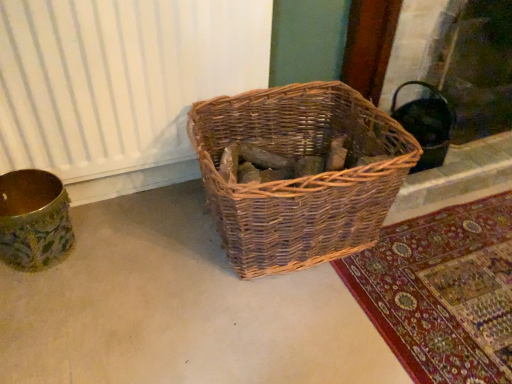
What do you see at coordinates (300, 178) in the screenshot? This screenshot has height=384, width=512. I see `natural woven basket at center` at bounding box center [300, 178].

Locate an element on the screen. gold textured vase at left is located at coordinates (33, 219).

Identify the location of natural woven basket at center. (300, 178).

Is white textured radiator at left spatially inside natural woven basket at center, or outside of it?

white textured radiator at left is not enclosed by natural woven basket at center.

From the image's perspective, who appears lower, white textured radiator at left or natural woven basket at center?

natural woven basket at center.

Who is bigger, white textured radiator at left or natural woven basket at center?

Bigger between the two is natural woven basket at center.

Is point (50, 13) in front of point (289, 114)?

That is True.

Does point (34, 204) lie behind point (493, 100)?

No, (34, 204) is closer to viewer.

Considering the relative sizes of gold textured vase at left and black matte fireplace at upper right in the image provided, is gold textured vase at left wider than black matte fireplace at upper right?

No.

Is gold textured vase at left facing towards black matte fireplace at upper right?

No.

From the image's perspective, is gold textured vase at left under white textured radiator at left?

Indeed, from the image's perspective, gold textured vase at left is shown beneath white textured radiator at left.

Which is behind, gold textured vase at left or white textured radiator at left?

gold textured vase at left is more distant.

Identify the location of radiator in front of the gold textured vase at left. The width and height of the screenshot is (512, 384). (119, 78).

Is gold textured vase at left oriented towards white textured radiator at left?

No, gold textured vase at left does not turn towards white textured radiator at left.

Can we say natural woven basket at center lies outside black matte fireplace at upper right?

Yes.

Consider the image. Who is smaller, natural woven basket at center or black matte fireplace at upper right?

natural woven basket at center is smaller.

Where is `fireplace on the right side of natural woven basket at center`? Image resolution: width=512 pixels, height=384 pixels. fireplace on the right side of natural woven basket at center is located at coordinates coord(464,64).

How many degrees apart are the facing directions of natural woven basket at center and black matte fireplace at upper right?

There is a 3.67-degree angle between the facing directions of natural woven basket at center and black matte fireplace at upper right.

From a real-world perspective, is white textured radiator at left positioned over black matte fireplace at upper right based on gravity?

Yes, from a real-world perspective, white textured radiator at left is over black matte fireplace at upper right

Who is bigger, white textured radiator at left or black matte fireplace at upper right?

Bigger between the two is black matte fireplace at upper right.

Is white textured radiator at left wider or thinner than black matte fireplace at upper right?

Clearly, white textured radiator at left has less width compared to black matte fireplace at upper right.

Based on their positions, is white textured radiator at left located to the left or right of black matte fireplace at upper right?

Based on their positions, white textured radiator at left is located to the left of black matte fireplace at upper right.

Which of these two, white textured radiator at left or gold textured vase at left, stands taller?

white textured radiator at left.

Measure the distance between white textured radiator at left and gold textured vase at left.

They are 12.44 inches apart.

At what (x,y) coordinates should I click in order to perform the action: click on radiator located above the gold textured vase at left (from a real-world perspective). Please return your answer as a coordinate pair (x, y). The image size is (512, 384). Looking at the image, I should click on (119, 78).

From a real-world perspective, does white textured radiator at left stand above gold textured vase at left?

Indeed, from a real-world perspective, white textured radiator at left stands above gold textured vase at left.

Does gold textured vase at left lie behind natural woven basket at center?

Yes, it is behind natural woven basket at center.

Which of these two, gold textured vase at left or natural woven basket at center, is smaller?

With smaller size is gold textured vase at left.

Choose the correct answer: Is gold textured vase at left inside natural woven basket at center or outside it?

gold textured vase at left is outside natural woven basket at center.

Locate an element on the screen. The width and height of the screenshot is (512, 384). radiator on the left side of natural woven basket at center is located at coordinates (119, 78).

Find the location of `fireplace above the gold textured vase at left (from a real-world perspective)`. fireplace above the gold textured vase at left (from a real-world perspective) is located at coordinates (464, 64).

Based on their spatial positions, is gold textured vase at left or black matte fireplace at upper right closer to natural woven basket at center?

black matte fireplace at upper right.

Considering their positions, is black matte fireplace at upper right positioned further to natural woven basket at center than gold textured vase at left?

Among the two, gold textured vase at left is located further to natural woven basket at center.

From the image, which object appears to be farther from white textured radiator at left, gold textured vase at left or natural woven basket at center?

natural woven basket at center lies further to white textured radiator at left than the other object.

Looking at the image, which one is located further to gold textured vase at left, black matte fireplace at upper right or natural woven basket at center?

Among the two, black matte fireplace at upper right is located further to gold textured vase at left.

From the picture: When comparing their distances from white textured radiator at left, does black matte fireplace at upper right or gold textured vase at left seem further?

Among the two, black matte fireplace at upper right is located further to white textured radiator at left.

Looking at the image, which one is located closer to gold textured vase at left, white textured radiator at left or natural woven basket at center?

white textured radiator at left is closer to gold textured vase at left.

Based on their spatial positions, is white textured radiator at left or black matte fireplace at upper right further from gold textured vase at left?

black matte fireplace at upper right lies further to gold textured vase at left than the other object.

Considering their positions, is white textured radiator at left positioned further to black matte fireplace at upper right than gold textured vase at left?

gold textured vase at left lies further to black matte fireplace at upper right than the other object.

Identify the location of radiator between gold textured vase at left and black matte fireplace at upper right in the horizontal direction. This screenshot has height=384, width=512. (119, 78).

Where is `picnic basket between gold textured vase at left and black matte fireplace at upper right in the horizontal direction`? The image size is (512, 384). picnic basket between gold textured vase at left and black matte fireplace at upper right in the horizontal direction is located at coordinates (300, 178).

Where is `picnic basket situated between white textured radiator at left and black matte fireplace at upper right from left to right`? The width and height of the screenshot is (512, 384). picnic basket situated between white textured radiator at left and black matte fireplace at upper right from left to right is located at coordinates (300, 178).

The width and height of the screenshot is (512, 384). Find the location of `radiator between gold textured vase at left and natural woven basket at center from left to right`. radiator between gold textured vase at left and natural woven basket at center from left to right is located at coordinates (119, 78).